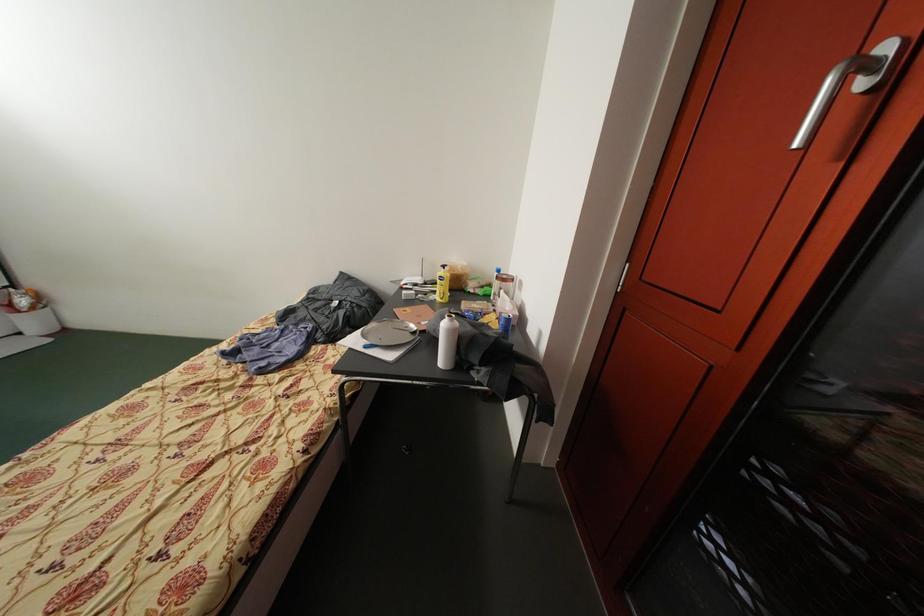
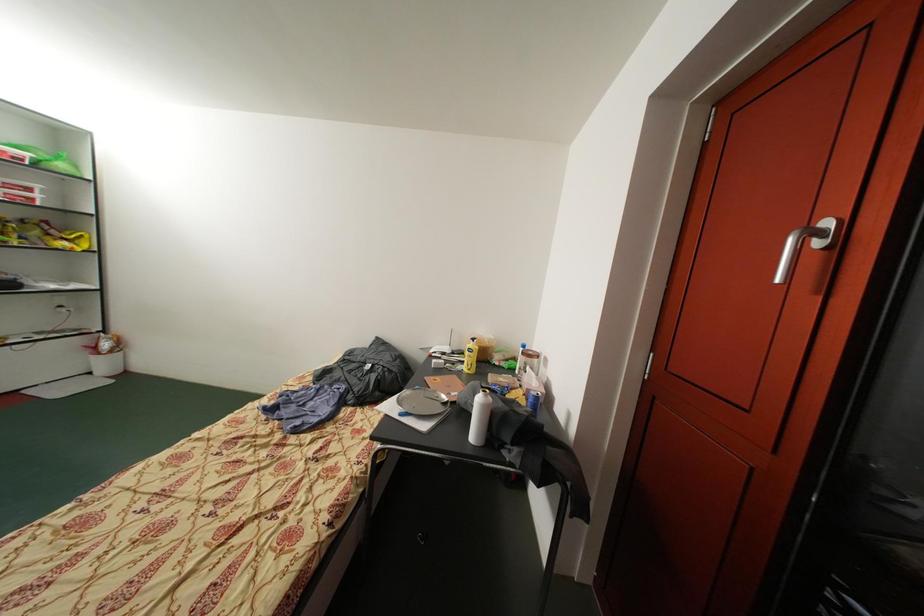
Question: The first image is from the beginning of the video and the second image is from the end. How did the camera likely rotate when shooting the video?

Choices:
 (A) Left
 (B) Right
 (C) Up
 (D) Down

Answer: (C)